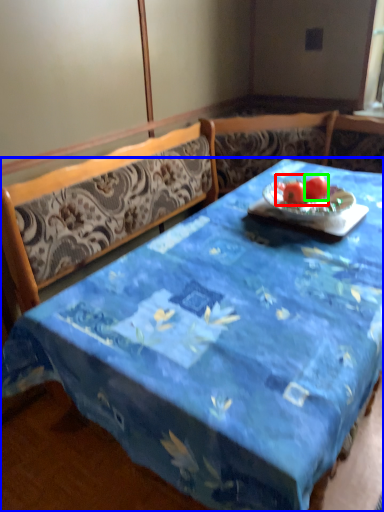
Question: Which is nearer to the fruit (highlighted by a red box)? desk (highlighted by a blue box) or tomato (highlighted by a green box).

Choices:
 (A) desk
 (B) tomato

Answer: (B)